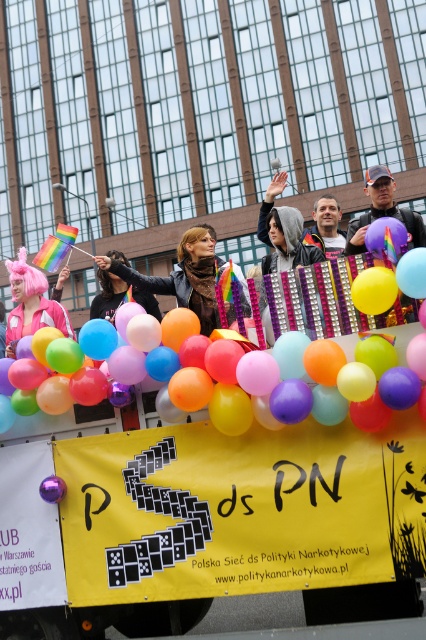
You are a photographer at the event and want to capture a photo that includes both the smooth leather jacket at center and the pink synthetic wig at upper center. Which object should you focus on first to ensure both are in frame?

The smooth leather jacket at center is located below the pink synthetic wig at upper center, so you should focus on the pink synthetic wig at upper center first to ensure both are in frame.

You are a photographer at the event and want to capture both the matte black baseball cap at upper center and the smooth leather jacket at center in a single shot. Which object should you adjust your camera to focus on first to ensure both are in frame?

The matte black baseball cap at upper center is positioned on the right side of smooth leather jacket at center, so focus on the smooth leather jacket at center first to ensure both are in frame.

You are a photographer trying to capture the float with both the matte black baseball cap at upper center and the smooth leather jacket at center in the frame. Which object should you adjust your camera focus on first if you want to ensure the larger object is in sharp focus?

The matte black baseball cap at upper center has a larger width than the smooth leather jacket at center, so you should focus on the matte black baseball cap at upper center first to ensure it is in sharp focus.